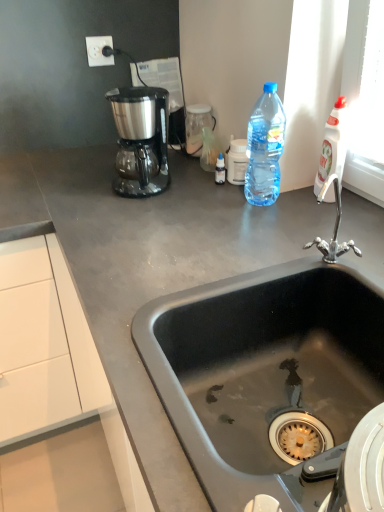
Question: From a real-world perspective, is satin black coffee maker at upper left physically located above or below white plastic electric outlet at upper left?

Choices:
 (A) above
 (B) below

Answer: (B)

Question: In the image, is satin black coffee maker at upper left on the left side or the right side of white plastic electric outlet at upper left?

Choices:
 (A) right
 (B) left

Answer: (A)

Question: Which of these objects is positioned closest to the white plastic electric outlet at upper left?

Choices:
 (A) translucent plastic bottle at upper right, the 2th bottle from the right
 (B) gray matte countertop at center
 (C) satin black coffee maker at upper left
 (D) white plastic bottle at upper right, the 1th bottle when ordered from right to left
 (E) black matte sink at center

Answer: (C)

Question: Based on their relative distances, which object is farther from the gray matte countertop at center?

Choices:
 (A) translucent plastic bottle at upper right, the 1th bottle in the left-to-right sequence
 (B) white plastic electric outlet at upper left
 (C) satin black coffee maker at upper left
 (D) white plastic bottle at upper right, the 1th bottle when ordered from right to left
 (E) black matte sink at center

Answer: (B)